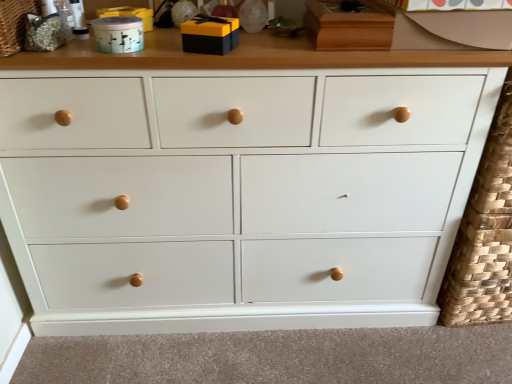
Question: Does textured woven basket at upper left lie behind matte black gift box at upper center, which appears as the 1th toy when viewed from the right?

Choices:
 (A) yes
 (B) no

Answer: (B)

Question: Is textured woven basket at upper left oriented away from matte black gift box at upper center, which appears as the 1th toy when viewed from the right?

Choices:
 (A) yes
 (B) no

Answer: (B)

Question: Can you confirm if textured woven basket at upper left is taller than matte black gift box at upper center, which appears as the 1th toy when viewed from the right?

Choices:
 (A) yes
 (B) no

Answer: (A)

Question: Is matte black gift box at upper center, which appears as the 1th toy when viewed from the right, a part of textured woven basket at upper left?

Choices:
 (A) yes
 (B) no

Answer: (B)

Question: Can you confirm if textured woven basket at upper left is shorter than matte black gift box at upper center, acting as the second toy starting from the left?

Choices:
 (A) yes
 (B) no

Answer: (B)

Question: Do you think matte teal ceramic container at upper left, acting as the first toy starting from the left, is within matte black gift box at upper center, acting as the second toy starting from the left, or outside of it?

Choices:
 (A) outside
 (B) inside

Answer: (A)

Question: Is point (105, 24) positioned closer to the camera than point (232, 19)?

Choices:
 (A) farther
 (B) closer

Answer: (B)

Question: Visually, is matte teal ceramic container at upper left, acting as the first toy starting from the left, positioned to the left or to the right of matte black gift box at upper center, acting as the second toy starting from the left?

Choices:
 (A) right
 (B) left

Answer: (B)

Question: Relative to matte black gift box at upper center, acting as the second toy starting from the left, is matte teal ceramic container at upper left, placed as the second toy when sorted from right to left, in front or behind?

Choices:
 (A) behind
 (B) front

Answer: (A)

Question: Which is correct: white painted wood chest of drawers at center is inside matte teal ceramic container at upper left, placed as the second toy when sorted from right to left, or outside of it?

Choices:
 (A) inside
 (B) outside

Answer: (B)

Question: From the image's perspective, is white painted wood chest of drawers at center located above or below matte teal ceramic container at upper left, acting as the first toy starting from the left?

Choices:
 (A) above
 (B) below

Answer: (B)

Question: In terms of height, does white painted wood chest of drawers at center look taller or shorter compared to matte teal ceramic container at upper left, acting as the first toy starting from the left?

Choices:
 (A) short
 (B) tall

Answer: (B)

Question: Considering the positions of white painted wood chest of drawers at center and matte teal ceramic container at upper left, placed as the second toy when sorted from right to left, in the image, is white painted wood chest of drawers at center bigger or smaller than matte teal ceramic container at upper left, placed as the second toy when sorted from right to left,?

Choices:
 (A) small
 (B) big

Answer: (B)

Question: In the image, is matte black gift box at upper center, which appears as the 1th toy when viewed from the right, on the left side or the right side of matte teal ceramic container at upper left, placed as the second toy when sorted from right to left?

Choices:
 (A) left
 (B) right

Answer: (B)

Question: In terms of height, does matte black gift box at upper center, which appears as the 1th toy when viewed from the right, look taller or shorter compared to matte teal ceramic container at upper left, acting as the first toy starting from the left?

Choices:
 (A) short
 (B) tall

Answer: (B)